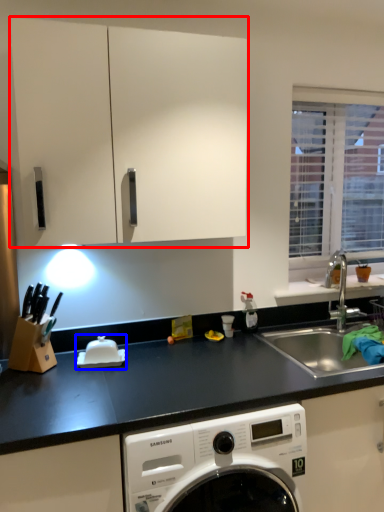
Question: Which object appears closest to the camera in this image, cabinetry (highlighted by a red box) or appliance (highlighted by a blue box)?

Choices:
 (A) cabinetry
 (B) appliance

Answer: (A)